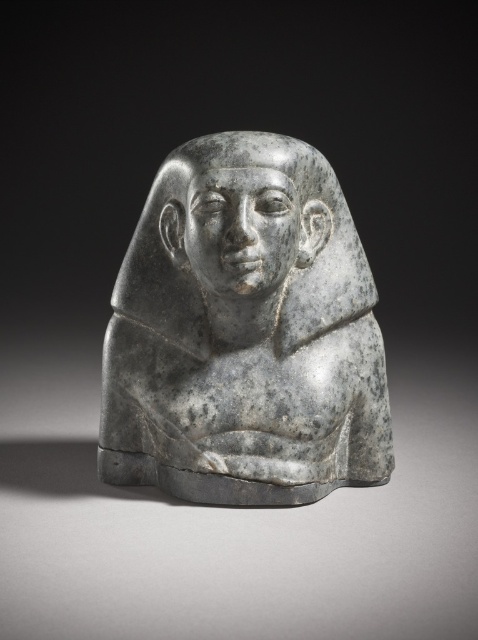
You are an archaeologist examining the image of the stone sculpture. Based on its position in the image, can you determine the exact coordinates of the gray stone bust at center?

The gray stone bust at center is located at coordinates point (245, 333).

Looking at this image, you are an art conservator examining the stone sculpture. You need to determine which part of the sculpture is wider for proper preservation. Which is wider, the gray stone bust at center or the gray stone head at center?

The gray stone bust at center is wider than the gray stone head at center according to the description.

You are an archaeologist examining the stone sculpture. You notice two parts of the sculpture labeled as the gray stone bust at center and the gray stone head at center. Which part is closer to you?

The gray stone head at center is closer to you because the distance between them is 2.42 inches, indicating the head is positioned in front of the bust.